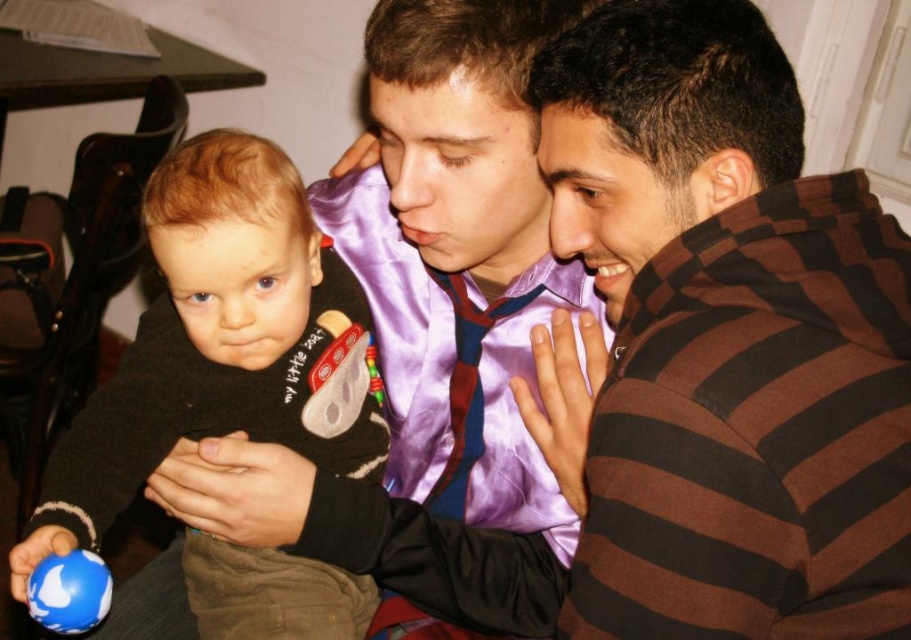
Question: Is black fleece sweater at left positioned in front of soft black sweater at center?

Choices:
 (A) no
 (B) yes

Answer: (B)

Question: Which object is positioned farthest from the brown striped shirt at right?

Choices:
 (A) soft black sweater at center
 (B) blue rubber ball at lower left
 (C) black fleece sweater at left

Answer: (B)

Question: Is brown striped shirt at right smaller than soft black sweater at center?

Choices:
 (A) no
 (B) yes

Answer: (A)

Question: Is soft black sweater at center to the left of blue rubber ball at lower left from the viewer's perspective?

Choices:
 (A) no
 (B) yes

Answer: (A)

Question: Estimate the real-world distances between objects in this image. Which object is farther from the soft black sweater at center?

Choices:
 (A) brown striped shirt at right
 (B) blue rubber ball at lower left
 (C) black fleece sweater at left

Answer: (A)

Question: Which object is positioned farthest from the blue rubber ball at lower left?

Choices:
 (A) soft black sweater at center
 (B) black fleece sweater at left
 (C) brown striped shirt at right

Answer: (C)